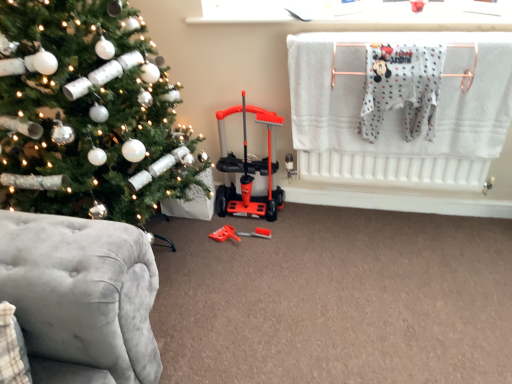
Question: Can you confirm if white cotton onesie at upper right is positioned to the left of orange plastic toy at center?

Choices:
 (A) no
 (B) yes

Answer: (A)

Question: Does white cotton onesie at upper right have a lesser height compared to orange plastic toy at center?

Choices:
 (A) yes
 (B) no

Answer: (B)

Question: Is white cotton onesie at upper right facing away from orange plastic toy at center?

Choices:
 (A) no
 (B) yes

Answer: (A)

Question: Does white cotton onesie at upper right turn towards orange plastic toy at center?

Choices:
 (A) yes
 (B) no

Answer: (B)

Question: Is white cotton onesie at upper right bigger than orange plastic toy at center?

Choices:
 (A) yes
 (B) no

Answer: (A)

Question: Considering the positions of white cotton onesie at upper right and orange plastic toy at center in the image, is white cotton onesie at upper right taller or shorter than orange plastic toy at center?

Choices:
 (A) short
 (B) tall

Answer: (B)

Question: Looking at their shapes, would you say white cotton onesie at upper right is wider or thinner than orange plastic toy at center?

Choices:
 (A) thin
 (B) wide

Answer: (A)

Question: From the image's perspective, relative to orange plastic toy at center, is white cotton onesie at upper right above or below?

Choices:
 (A) below
 (B) above

Answer: (B)

Question: Is point (378, 64) closer or farther from the camera than point (224, 238)?

Choices:
 (A) closer
 (B) farther

Answer: (A)

Question: Is orange plastic baby carriage at center taller or shorter than shiny silver ornaments at left?

Choices:
 (A) tall
 (B) short

Answer: (B)

Question: In terms of size, does orange plastic baby carriage at center appear bigger or smaller than shiny silver ornaments at left?

Choices:
 (A) small
 (B) big

Answer: (A)

Question: Which is correct: orange plastic baby carriage at center is inside shiny silver ornaments at left, or outside of it?

Choices:
 (A) outside
 (B) inside

Answer: (A)

Question: Is point (268, 183) positioned closer to the camera than point (192, 170)?

Choices:
 (A) closer
 (B) farther

Answer: (B)

Question: In terms of width, does orange plastic baby carriage at center look wider or thinner when compared to white cotton onesie at upper right?

Choices:
 (A) thin
 (B) wide

Answer: (B)

Question: Is point (245, 203) closer or farther from the camera than point (421, 94)?

Choices:
 (A) farther
 (B) closer

Answer: (A)